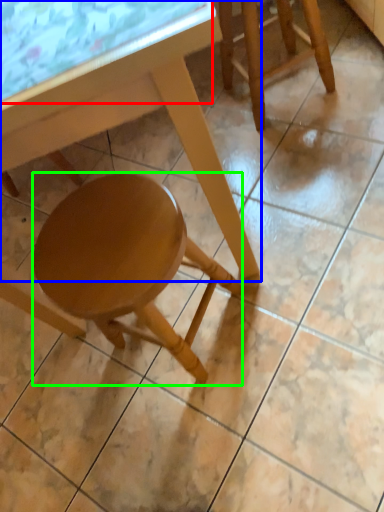
Question: Based on their relative distances, which object is farther from glass table (highlighted by a red box)? Choose from table (highlighted by a blue box) and stool (highlighted by a green box).

Choices:
 (A) table
 (B) stool

Answer: (B)